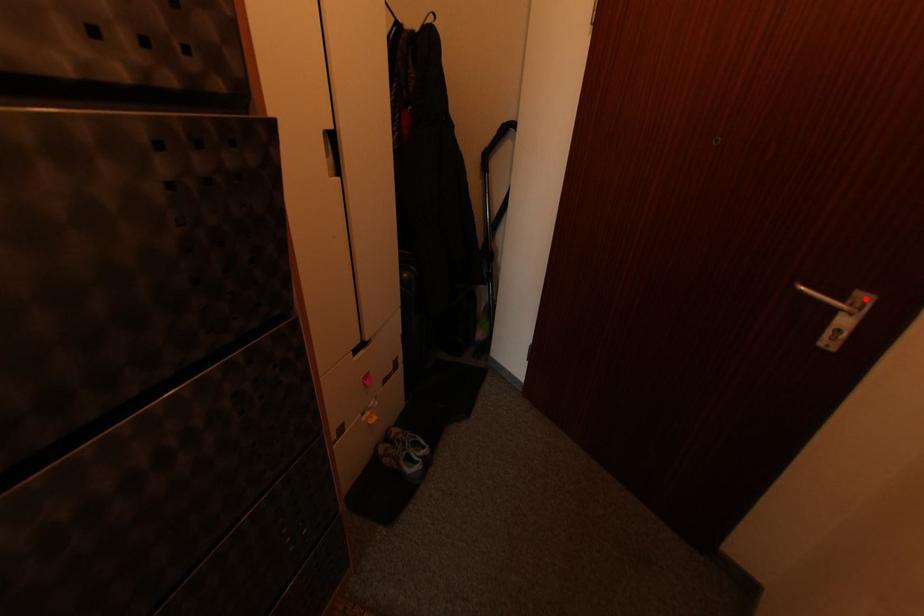
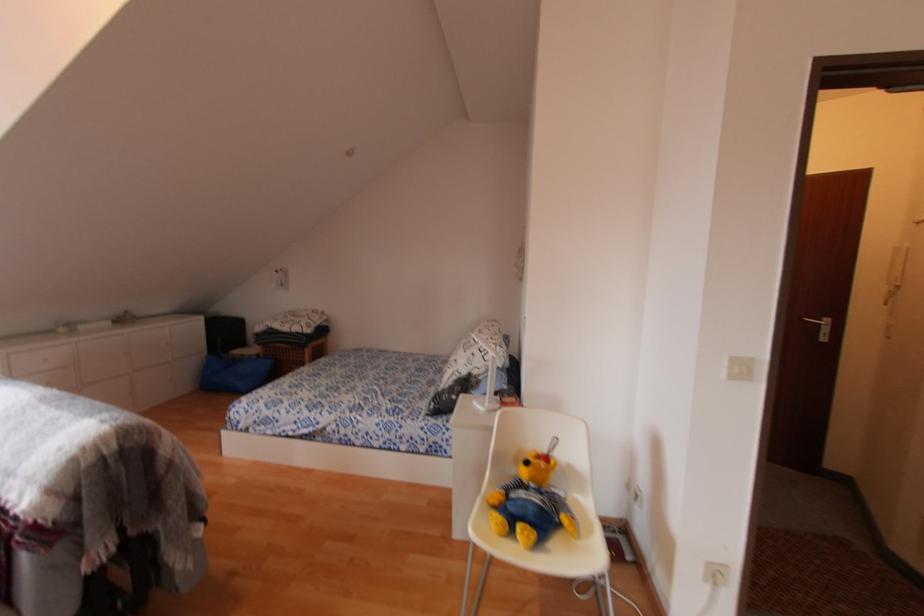
Question: I am providing you with two images of the same scene from different viewpoints. Given a red point in image1, look at the same physical point in image2. Is it:

Choices:
 (A) Closer to the viewpoint
 (B) Farther from the viewpoint

Answer: (A)